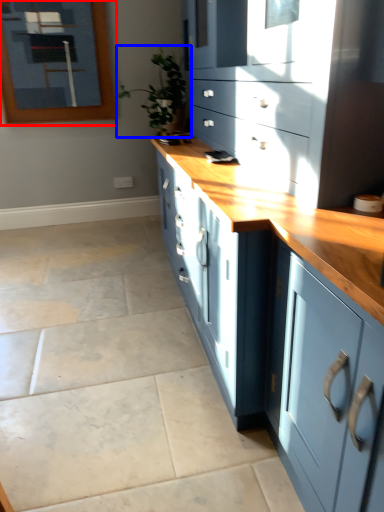
Question: Which object is closer to the camera taking this photo, picture frame (highlighted by a red box) or houseplant (highlighted by a blue box)?

Choices:
 (A) picture frame
 (B) houseplant

Answer: (B)